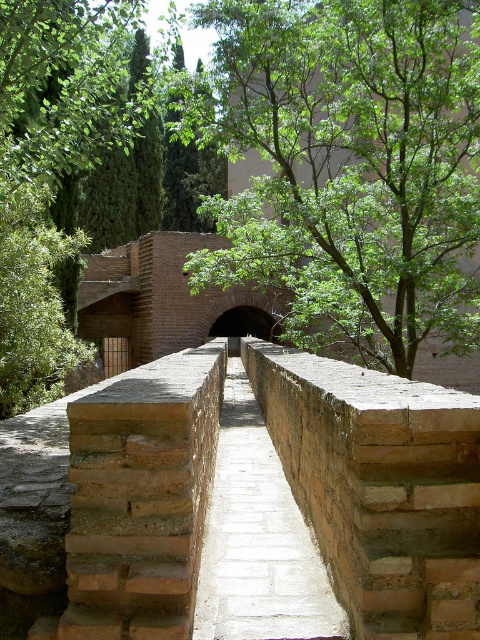
You are a visitor walking along the smooth stone path at center in a historic garden. You want to take a photo of the green leafy tree at center without any obstructions. Is the tree currently blocking your view of the path behind it?

The smooth stone path at center is behind the green leafy tree at center, so the tree is blocking your view of the path behind it. To take a photo without obstruction, you might need to move to a different angle where the tree is not in front of the path.